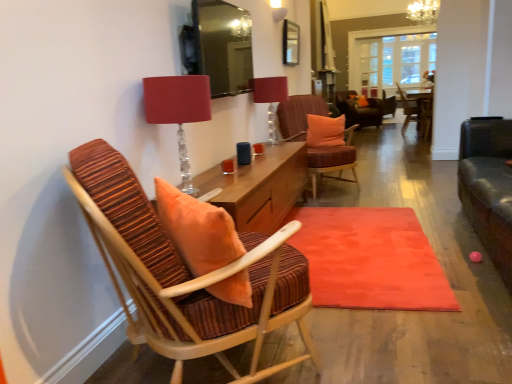
Question: Is clear glass door at center far from orange fabric pillow at center, which is counted as the second pillow, starting from the front?

Choices:
 (A) no
 (B) yes

Answer: (B)

Question: Is clear glass door at center not inside orange fabric pillow at center, the 1th pillow positioned from the top?

Choices:
 (A) yes
 (B) no

Answer: (A)

Question: Does clear glass door at center turn towards orange fabric pillow at center, which is the 1th pillow in right-to-left order?

Choices:
 (A) no
 (B) yes

Answer: (B)

Question: Considering the relative positions of clear glass door at center and orange fabric pillow at center, which is counted as the second pillow, starting from the front, in the image provided, is clear glass door at center to the left of orange fabric pillow at center, which is counted as the second pillow, starting from the front, from the viewer's perspective?

Choices:
 (A) no
 (B) yes

Answer: (A)

Question: From the image's perspective, is clear glass door at center below orange fabric pillow at center, which is counted as the second pillow, starting from the front?

Choices:
 (A) no
 (B) yes

Answer: (A)

Question: Is clear glass door at center shorter than orange fabric pillow at center, placed as the first pillow when sorted from back to front?

Choices:
 (A) yes
 (B) no

Answer: (B)

Question: Is matte red lampshade at upper center, marked as the 2th table lamp in a top-to-bottom arrangement, surrounding orange fabric pillow at center, marked as the 2th pillow in a back-to-front arrangement?

Choices:
 (A) no
 (B) yes

Answer: (A)

Question: From a real-world perspective, is matte red lampshade at upper center, which ranks as the second table lamp in back-to-front order, below orange fabric pillow at center, the first pillow from the left?

Choices:
 (A) yes
 (B) no

Answer: (B)

Question: Is matte red lampshade at upper center, marked as the 2th table lamp in a top-to-bottom arrangement, positioned with its back to orange fabric pillow at center, the second pillow from the top?

Choices:
 (A) yes
 (B) no

Answer: (B)

Question: Would you say matte red lampshade at upper center, the 2th table lamp positioned from the right, is a long distance from orange fabric pillow at center, placed as the first pillow when sorted from bottom to top?

Choices:
 (A) no
 (B) yes

Answer: (B)

Question: Is matte red lampshade at upper center, the first table lamp ordered from the bottom, to the left of orange fabric pillow at center, marked as the 2th pillow in a back-to-front arrangement, from the viewer's perspective?

Choices:
 (A) yes
 (B) no

Answer: (A)

Question: Is matte red lampshade at upper center, the 2th table lamp positioned from the right, facing towards orange fabric pillow at center, the first pillow from the left?

Choices:
 (A) yes
 (B) no

Answer: (B)

Question: Is clear glass door at center oriented away from wooden chair with striped cushion at center, marked as the second chair in a back-to-front arrangement?

Choices:
 (A) yes
 (B) no

Answer: (B)